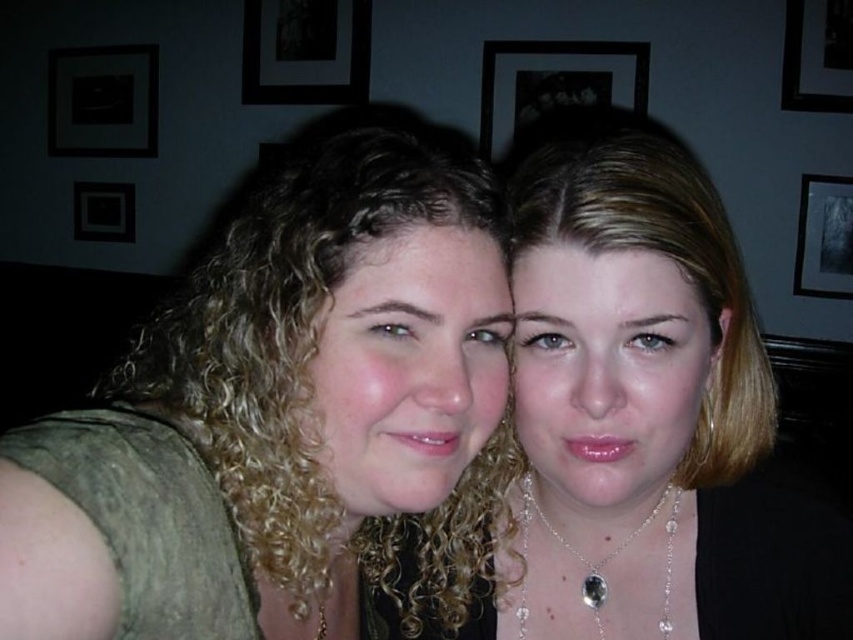
Who is more distant from viewer, [677,381] or [53,76]?

The point [53,76] is behind.

Is smooth blonde hair at center thinner than dark matte picture frame at upper left?

Correct, smooth blonde hair at center's width is less than dark matte picture frame at upper left's.

This screenshot has height=640, width=853. Describe the element at coordinates (654, 408) in the screenshot. I see `smooth blonde hair at center` at that location.

The height and width of the screenshot is (640, 853). I want to click on smooth blonde hair at center, so click(x=654, y=408).

Does black matte picture frame at upper center appear under dark matte picture frame at upper left?

Yes.

Is black matte picture frame at upper center closer to the viewer compared to dark matte picture frame at upper left?

Yes, black matte picture frame at upper center is closer to the viewer.

The width and height of the screenshot is (853, 640). What do you see at coordinates (554, 83) in the screenshot?
I see `black matte picture frame at upper center` at bounding box center [554, 83].

This screenshot has height=640, width=853. What are the coordinates of `black matte picture frame at upper center` in the screenshot? It's located at (554, 83).

Consider the image. Which is more to the left, dark matte picture frame at upper left or black matte picture frame at upper right?

dark matte picture frame at upper left is more to the left.

From the picture: Can you confirm if dark matte picture frame at upper left is taller than black matte picture frame at upper right?

Indeed, dark matte picture frame at upper left has a greater height compared to black matte picture frame at upper right.

What do you see at coordinates (102, 100) in the screenshot?
I see `dark matte picture frame at upper left` at bounding box center [102, 100].

At what (x,y) coordinates should I click in order to perform the action: click on dark matte picture frame at upper left. Please return your answer as a coordinate pair (x, y). The height and width of the screenshot is (640, 853). Looking at the image, I should click on (102, 100).